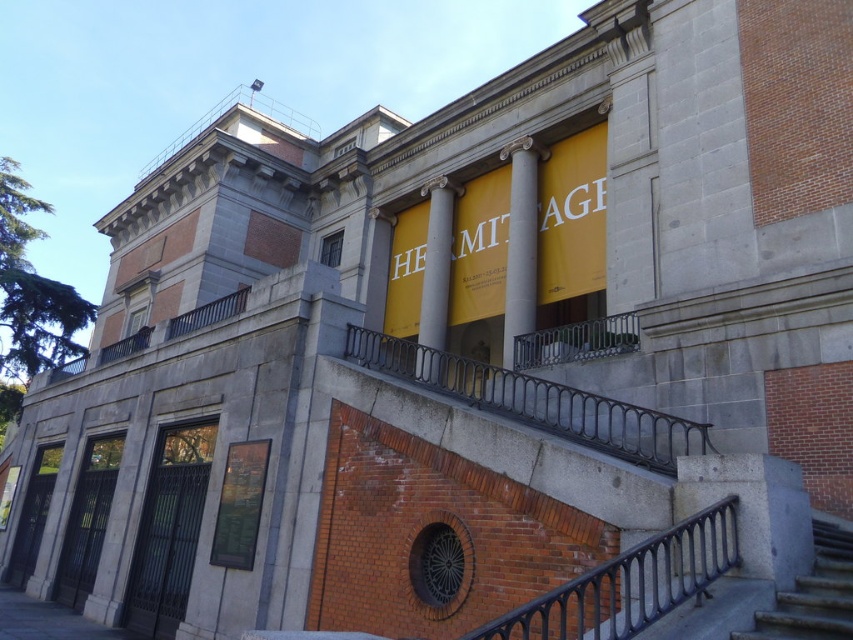
Question: Can you confirm if black metal balustrade at center is bigger than white marble pillar at center?

Choices:
 (A) no
 (B) yes

Answer: (A)

Question: Observing the image, what is the correct spatial positioning of smooth concrete stairs at lower right in reference to white marble pillar at center?

Choices:
 (A) left
 (B) right

Answer: (B)

Question: Is black metal balustrade at center closer to camera compared to gray stone column at center?

Choices:
 (A) no
 (B) yes

Answer: (B)

Question: Which of the following is the farthest from the observer?

Choices:
 (A) (646, 442)
 (B) (444, 205)
 (C) (814, 600)
 (D) (531, 148)

Answer: (B)

Question: Which object appears closest to the camera in this image?

Choices:
 (A) black metal railing at lower right
 (B) black metal balustrade at center

Answer: (A)

Question: Which point appears farthest from the camera in this image?

Choices:
 (A) (762, 632)
 (B) (635, 628)

Answer: (A)